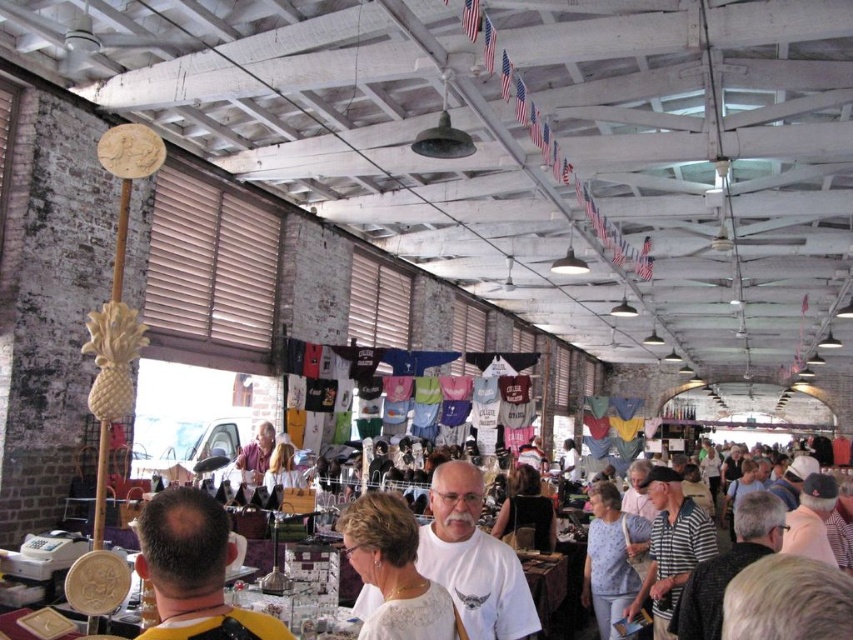
Consider the image. Does dark brown leather jacket at center have a lesser width compared to white matte t-shirt at center?

Indeed, dark brown leather jacket at center has a lesser width compared to white matte t-shirt at center.

Does dark brown leather jacket at center appear on the left side of white matte t-shirt at center?

Correct, you'll find dark brown leather jacket at center to the left of white matte t-shirt at center.

Is point (273, 618) closer to camera compared to point (527, 618)?

Yes, point (273, 618) is closer to viewer.

The height and width of the screenshot is (640, 853). Find the location of `dark brown leather jacket at center`. dark brown leather jacket at center is located at coordinates (193, 570).

Can you confirm if dark brown leather jacket at center is positioned below striped cotton shirt at center?

No, dark brown leather jacket at center is not below striped cotton shirt at center.

Is dark brown leather jacket at center positioned before striped cotton shirt at center?

Yes, dark brown leather jacket at center is closer to the viewer.

This screenshot has width=853, height=640. Describe the element at coordinates (193, 570) in the screenshot. I see `dark brown leather jacket at center` at that location.

You are a GUI agent. You are given a task and a screenshot of the screen. Output one action in this format:
    pyautogui.click(x=<x>, y=<y>)
    Task: Click on the dark brown leather jacket at center
    
    Given the screenshot: What is the action you would take?
    pyautogui.click(x=193, y=570)

Can you confirm if white matte t-shirt at center is positioned above striped cotton shirt at center?

Indeed, white matte t-shirt at center is positioned over striped cotton shirt at center.

Can you confirm if white matte t-shirt at center is positioned to the right of striped cotton shirt at center?

Incorrect, white matte t-shirt at center is not on the right side of striped cotton shirt at center.

Is point (529, 589) less distant than point (740, 566)?

That is False.

The height and width of the screenshot is (640, 853). Identify the location of white matte t-shirt at center. (473, 557).